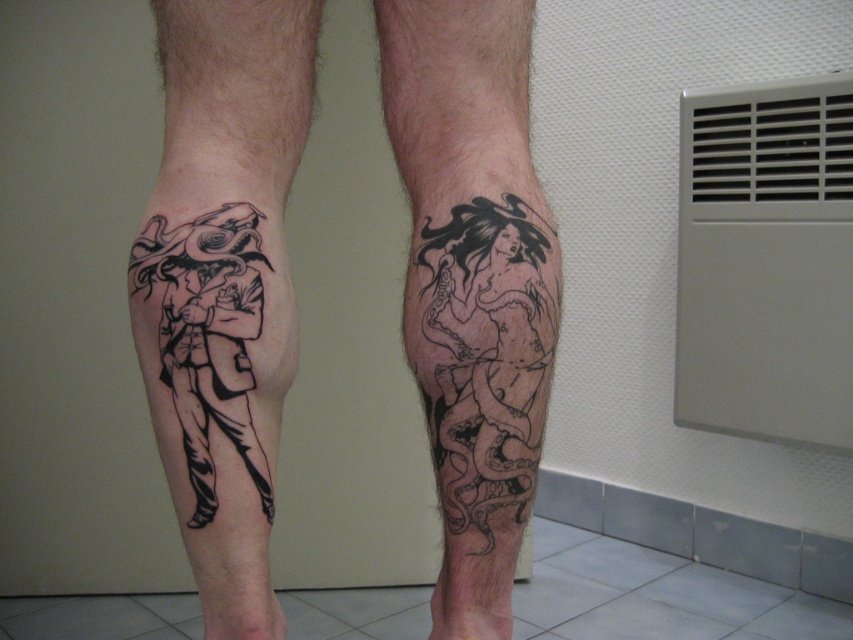
You are a photographer taking a closeup shot of the black ink tattoo at lower left. The camera is positioned 24 inches away from the subject. Will the tattoo be in focus if the camera has a depth of field that allows sharpness within 2 inches of the focal point?

Result: The black ink tattoo at lower left is 23.94 inches from the camera, which is within the 24 inch focal point range. Since the depth of field allows sharpness within 2 inches, the tattoo will be in focus.

You are a tattoo artist assessing the placement of the black ink tattoo at lower left and the black ink snake at lower center on the legs shown. Based on their positions, which object is closer to the viewer?

The black ink snake at lower center is closer to the viewer because it is positioned to the right of the black ink tattoo at lower left, which is further away.